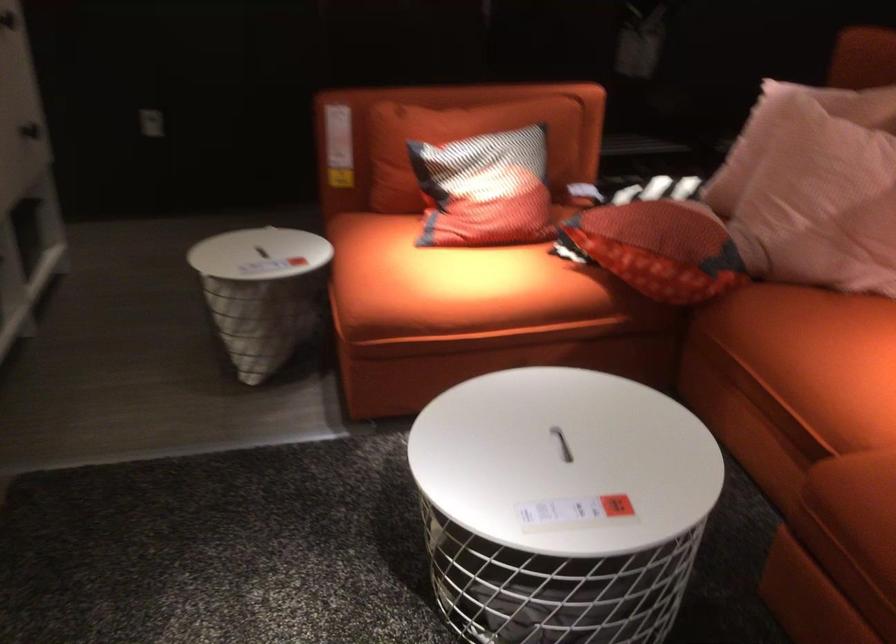
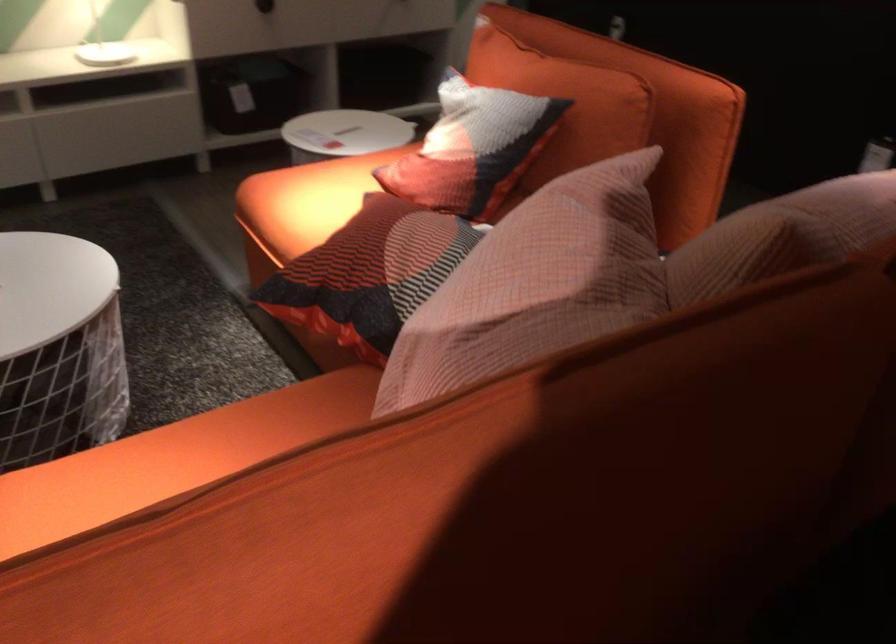
Where in the second image is the point corresponding to the point at 708,230 from the first image?

(369, 274)